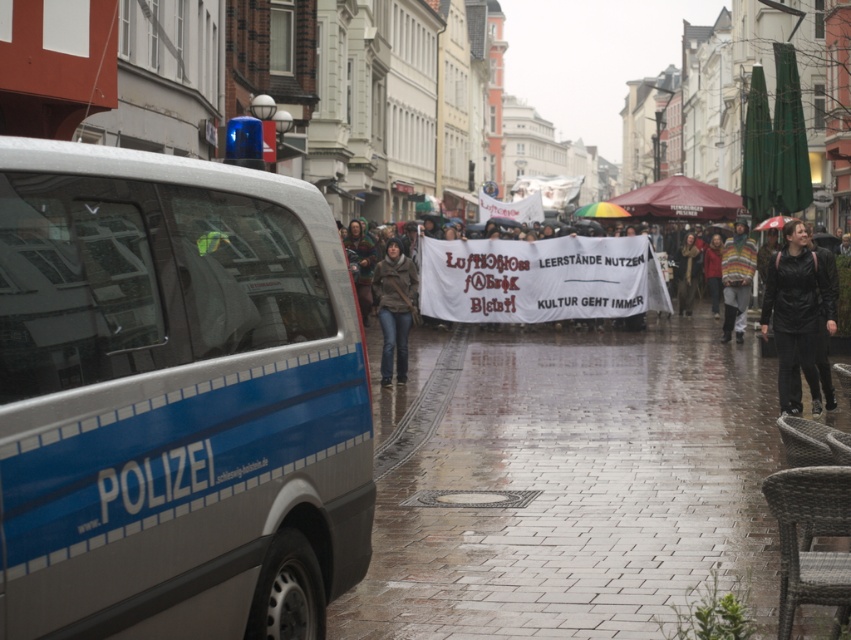
Who is higher up, black leather jacket at right or brown leather jacket at center?

brown leather jacket at center is above.

Locate an element on the screen. This screenshot has width=851, height=640. black leather jacket at right is located at coordinates (797, 310).

Is point (798, 307) more distant than point (374, 273)?

No, (798, 307) is in front of (374, 273).

Identify the location of black leather jacket at right. The image size is (851, 640). (797, 310).

Does silver metallic van at left appear over black leather jacket at right?

Incorrect, silver metallic van at left is not positioned above black leather jacket at right.

Find the location of a particular element. Image resolution: width=851 pixels, height=640 pixels. silver metallic van at left is located at coordinates (170, 392).

Does white fabric banner at center appear under brown leather jacket at center?

Indeed, white fabric banner at center is positioned under brown leather jacket at center.

Where is `white fabric banner at center`? white fabric banner at center is located at coordinates (530, 280).

Is point (650, 282) behind point (384, 385)?

Yes, it is.

You are a GUI agent. You are given a task and a screenshot of the screen. Output one action in this format:
    pyautogui.click(x=<x>, y=<y>)
    Task: Click on the white fabric banner at center
    The height and width of the screenshot is (640, 851).
    Given the screenshot: What is the action you would take?
    pyautogui.click(x=530, y=280)